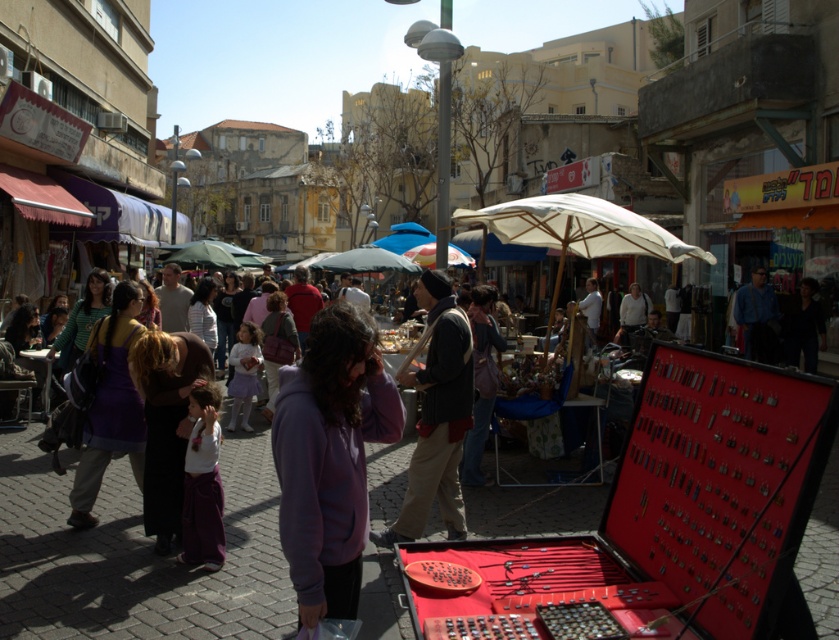
Question: Observing the image, what is the correct spatial positioning of knitted wool scarf at center in reference to white fabric umbrella at center?

Choices:
 (A) right
 (B) left

Answer: (B)

Question: Estimate the real-world distances between objects in this image. Which object is farther from the knitted wool scarf at center?

Choices:
 (A) purple fleece jacket at center
 (B) white fabric umbrella at center

Answer: (B)

Question: Among these points, which one is nearest to the camera?

Choices:
 (A) (561, 240)
 (B) (446, 477)
 (C) (314, 600)

Answer: (C)

Question: Which point appears farthest from the camera in this image?

Choices:
 (A) (x=582, y=228)
 (B) (x=352, y=365)
 (C) (x=447, y=451)

Answer: (A)

Question: Is knitted wool scarf at center to the left of white fabric umbrella at center from the viewer's perspective?

Choices:
 (A) yes
 (B) no

Answer: (A)

Question: Does purple fleece jacket at center appear under white fabric umbrella at center?

Choices:
 (A) no
 (B) yes

Answer: (B)